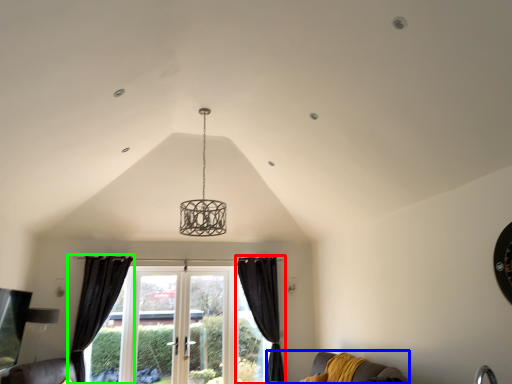
Question: Which object is positioned farthest from curtain (highlighted by a red box)? Select from couch (highlighted by a blue box) and curtain (highlighted by a green box).

Choices:
 (A) couch
 (B) curtain

Answer: (A)